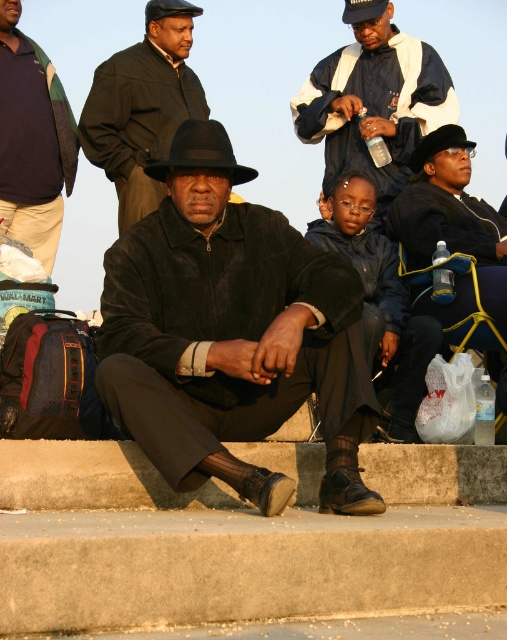
Question: Does matte black coat at upper center appear on the left side of black felt hat at upper center?

Choices:
 (A) yes
 (B) no

Answer: (A)

Question: Can you confirm if matte black coat at upper center is thinner than black felt fedora at center?

Choices:
 (A) yes
 (B) no

Answer: (B)

Question: Does suede black coat at center have a smaller size compared to black felt fedora at center?

Choices:
 (A) no
 (B) yes

Answer: (A)

Question: Which point is farther to the camera?

Choices:
 (A) (107, 170)
 (B) (210, 305)

Answer: (A)

Question: Considering the real-world distances, which object is farthest from the dark blue cotton shirt at upper left?

Choices:
 (A) black felt fedora at center
 (B) white and blue jacket at upper center
 (C) dark blue leather cap at upper center

Answer: (A)

Question: Which point is farther to the camera?

Choices:
 (A) [x=47, y=80]
 (B) [x=442, y=230]
 (C) [x=330, y=388]

Answer: (A)